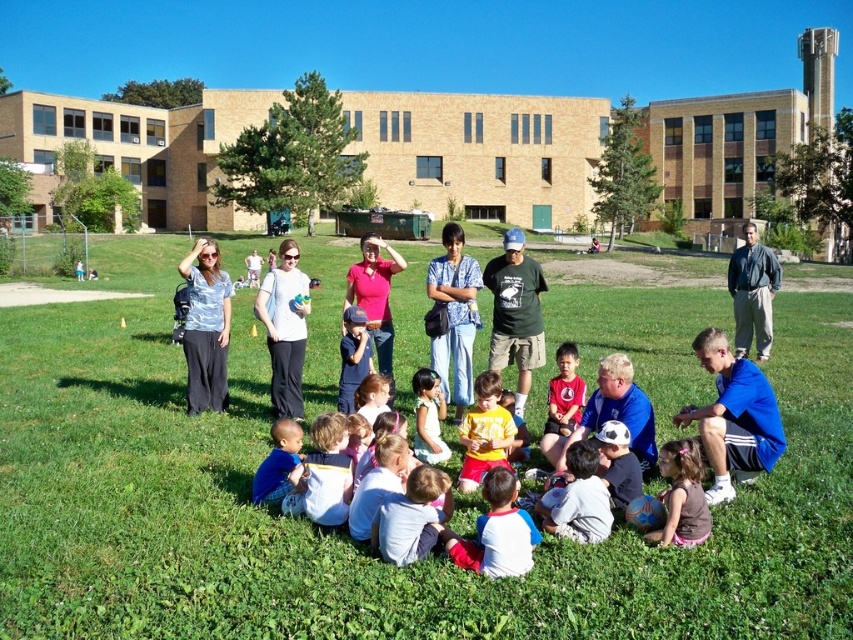
Can you confirm if matte blue shirt at center is positioned to the left of gray cotton jacket at right?

Indeed, matte blue shirt at center is positioned on the left side of gray cotton jacket at right.

Is matte blue shirt at center bigger than gray cotton jacket at right?

Incorrect, matte blue shirt at center is not larger than gray cotton jacket at right.

Which is in front, point (213, 324) or point (738, 268)?

Point (213, 324) is more forward.

Identify the location of matte blue shirt at center. (206, 326).

Can you confirm if blue plaid shirt at center is thinner than smooth pink shirt at center?

No, blue plaid shirt at center is not thinner than smooth pink shirt at center.

Which is in front, point (463, 392) or point (438, 440)?

Point (438, 440)

This screenshot has height=640, width=853. Identify the location of blue plaid shirt at center. (454, 316).

Does pink fabric dress at lower center appear on the right side of blue denim shorts at lower left?

Yes, pink fabric dress at lower center is to the right of blue denim shorts at lower left.

Which of these two, pink fabric dress at lower center or blue denim shorts at lower left, stands taller?

Standing taller between the two is pink fabric dress at lower center.

Image resolution: width=853 pixels, height=640 pixels. In order to click on pink fabric dress at lower center in this screenshot , I will do `click(682, 496)`.